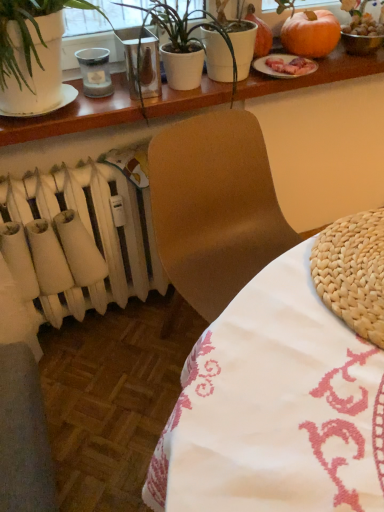
Question: Is white matte radiator at lower left thinner than white woven placemat at lower left, arranged as the second table when viewed from the top?

Choices:
 (A) no
 (B) yes

Answer: (B)

Question: Can you confirm if white matte radiator at lower left is taller than white woven placemat at lower left, arranged as the second table when viewed from the top?

Choices:
 (A) no
 (B) yes

Answer: (A)

Question: Is white matte radiator at lower left wider than white woven placemat at lower left, which ranks as the 1th table in bottom-to-top order?

Choices:
 (A) yes
 (B) no

Answer: (B)

Question: Does white matte radiator at lower left turn towards white woven placemat at lower left, which ranks as the 1th table in bottom-to-top order?

Choices:
 (A) no
 (B) yes

Answer: (B)

Question: Is white matte radiator at lower left further to camera compared to white woven placemat at lower left, arranged as the second table when viewed from the top?

Choices:
 (A) no
 (B) yes

Answer: (B)

Question: Is orange matte pumpkin at upper right taller or shorter than metallic glass vase at upper center?

Choices:
 (A) short
 (B) tall

Answer: (A)

Question: Which is correct: orange matte pumpkin at upper right is inside metallic glass vase at upper center, or outside of it?

Choices:
 (A) inside
 (B) outside

Answer: (B)

Question: In the image, is orange matte pumpkin at upper right positioned in front of or behind metallic glass vase at upper center?

Choices:
 (A) front
 (B) behind

Answer: (B)

Question: Considering the relative positions of orange matte pumpkin at upper right and metallic glass vase at upper center in the image provided, is orange matte pumpkin at upper right to the left or to the right of metallic glass vase at upper center?

Choices:
 (A) left
 (B) right

Answer: (B)

Question: Looking at the image, does metallic glass vase at upper center seem bigger or smaller compared to white glossy table at upper center, the 2th table positioned from the bottom?

Choices:
 (A) small
 (B) big

Answer: (A)

Question: Looking at their shapes, would you say metallic glass vase at upper center is wider or thinner than white glossy table at upper center, the 2th table positioned from the bottom?

Choices:
 (A) thin
 (B) wide

Answer: (A)

Question: Which is correct: metallic glass vase at upper center is inside white glossy table at upper center, which ranks as the first table in top-to-bottom order, or outside of it?

Choices:
 (A) outside
 (B) inside

Answer: (A)

Question: Considering the positions of metallic glass vase at upper center and white glossy table at upper center, the 2th table positioned from the bottom, in the image, is metallic glass vase at upper center taller or shorter than white glossy table at upper center, the 2th table positioned from the bottom,?

Choices:
 (A) short
 (B) tall

Answer: (B)

Question: Is white matte radiator at lower left situated inside metallic glass vase at upper center or outside?

Choices:
 (A) outside
 (B) inside

Answer: (A)

Question: In terms of size, does white matte radiator at lower left appear bigger or smaller than metallic glass vase at upper center?

Choices:
 (A) big
 (B) small

Answer: (A)